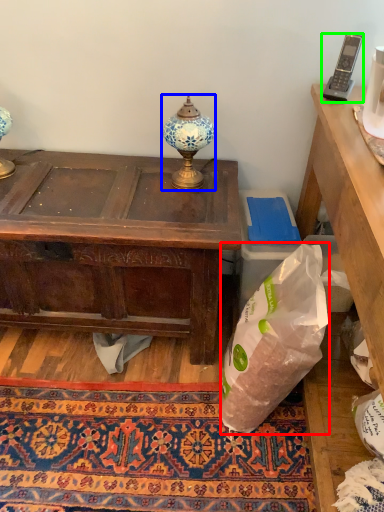
Question: Considering the real-world distances, which object is closest to plastic bag (highlighted by a red box)? lamp (highlighted by a blue box) or corded phone (highlighted by a green box).

Choices:
 (A) lamp
 (B) corded phone

Answer: (A)